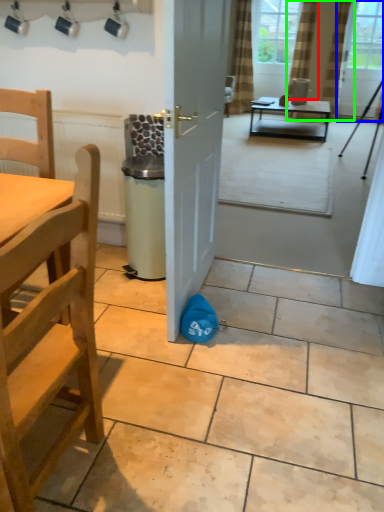
Question: Considering the real-world distances, which object is closest to curtain (highlighted by a red box)? window screen (highlighted by a blue box) or curtain (highlighted by a green box).

Choices:
 (A) window screen
 (B) curtain

Answer: (B)